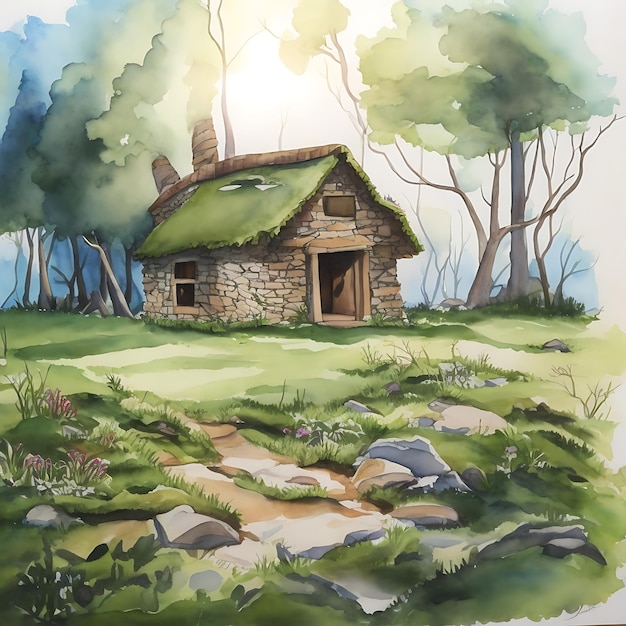
Locate an element on the screen. window is located at coordinates (181, 285).